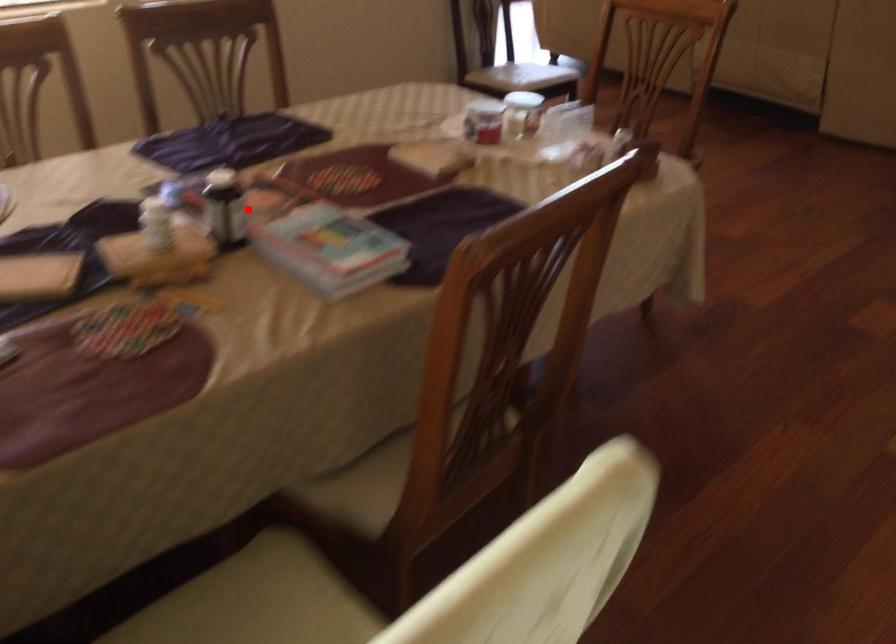
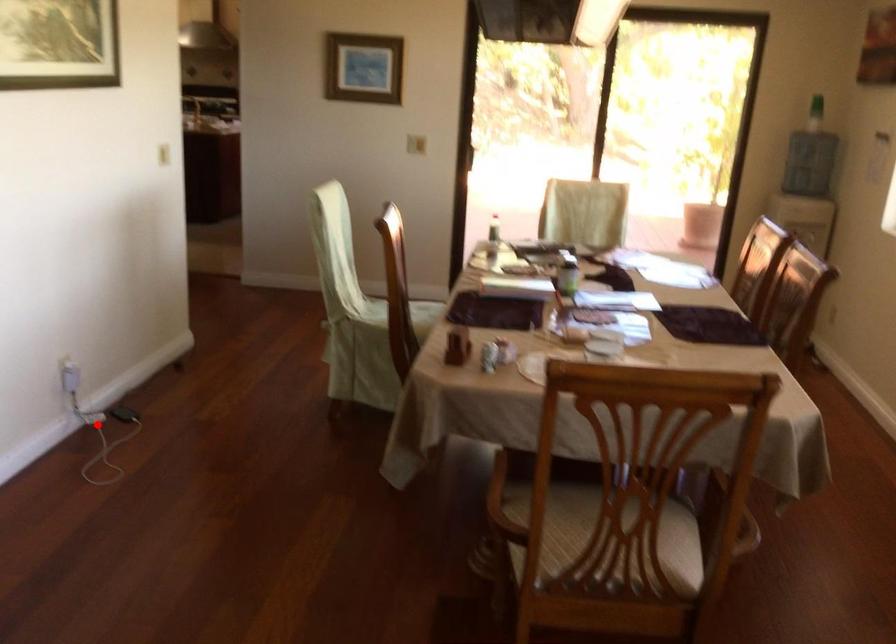
I am providing you with two images of the same scene from different viewpoints. A red point is marked on the first image and another point is marked on the second image. Are the points marked in image1 and image2 representing the same 3D position?

No